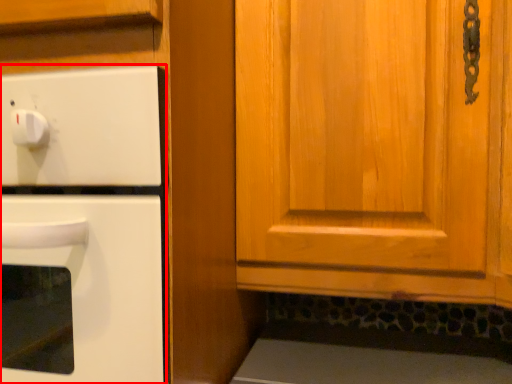
Question: From the image's perspective, where is oven (annotated by the red box) located relative to cabinetry?

Choices:
 (A) above
 (B) below

Answer: (B)